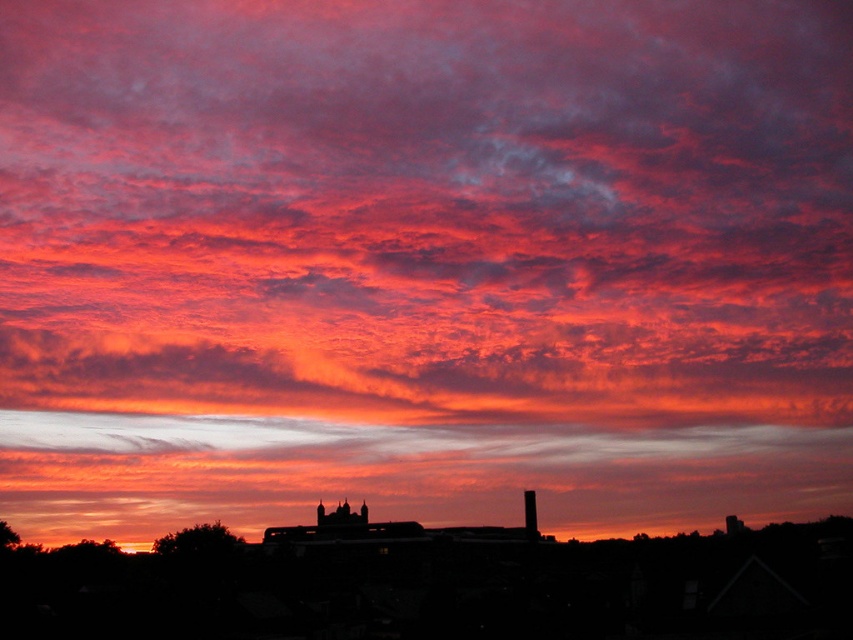
Question: Among these points, which one is farthest from the camera?

Choices:
 (A) (360, 518)
 (B) (534, 525)

Answer: (A)

Question: Where is black matte chimney at center located in relation to black brick chimney at center in the image?

Choices:
 (A) left
 (B) right

Answer: (A)

Question: Can you confirm if black matte chimney at center is wider than black brick chimney at center?

Choices:
 (A) no
 (B) yes

Answer: (B)

Question: Is black matte chimney at center to the right of black brick chimney at center from the viewer's perspective?

Choices:
 (A) no
 (B) yes

Answer: (A)